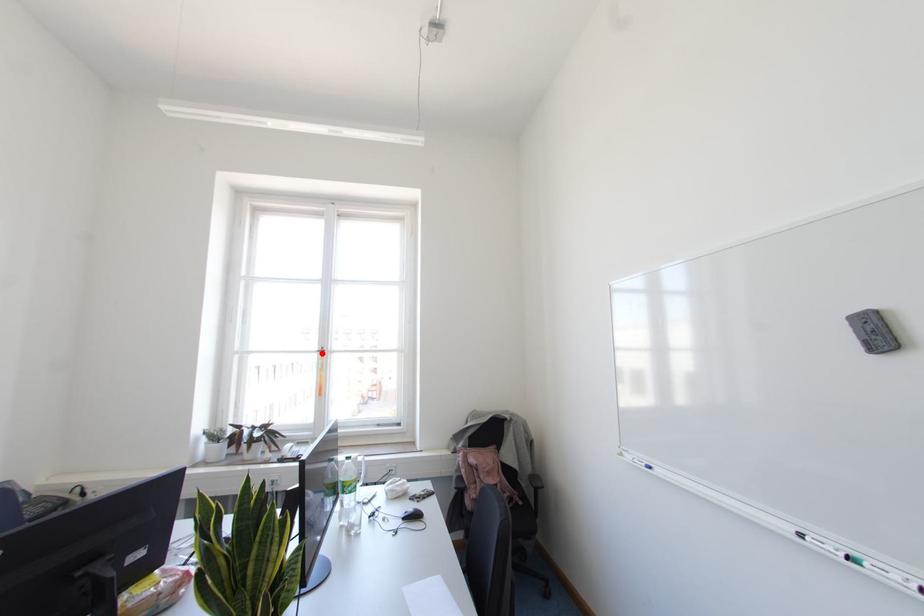
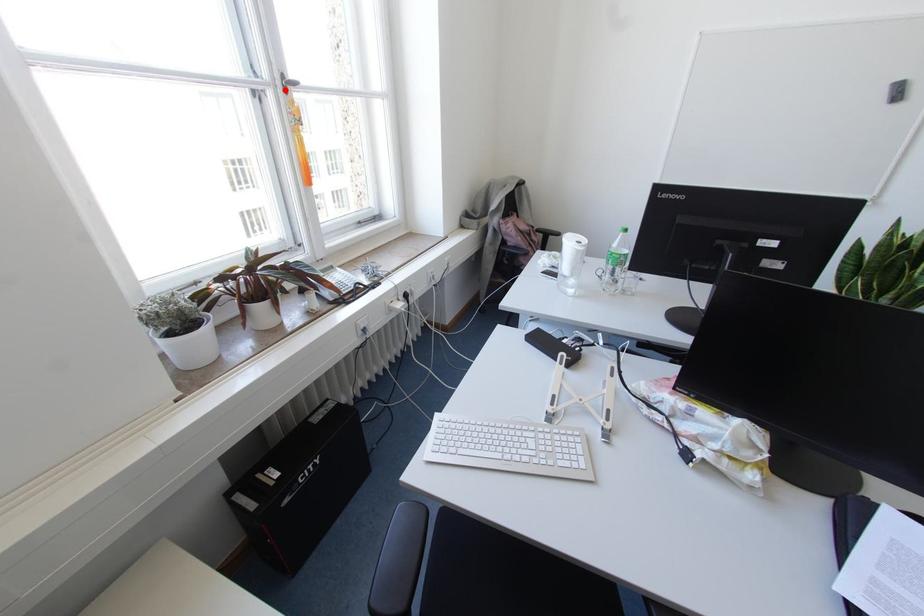
I am providing you with two images of the same scene from different viewpoints. A red point is marked on the first image and another point is marked on the second image. Is the red point in image1 aligned with the point shown in image2?

Yes